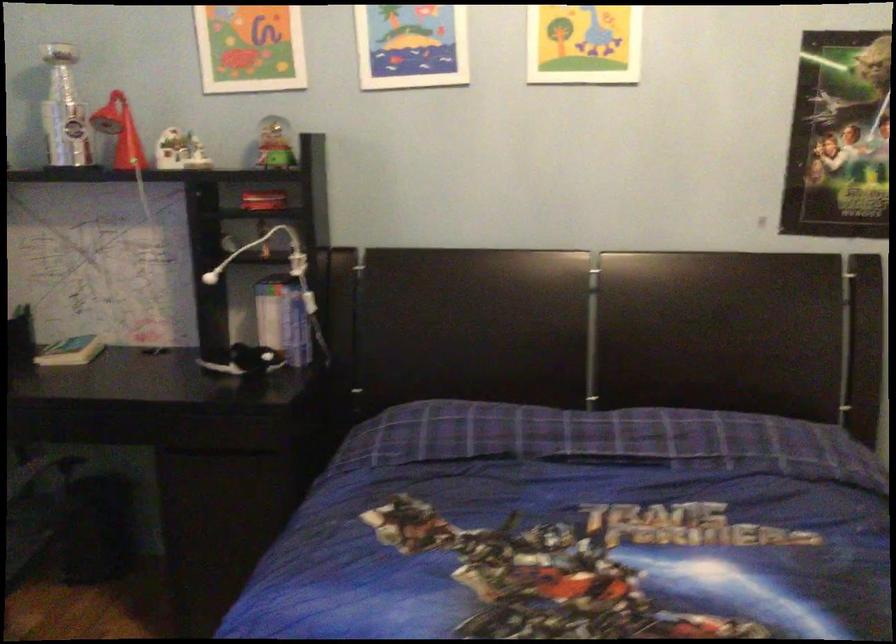
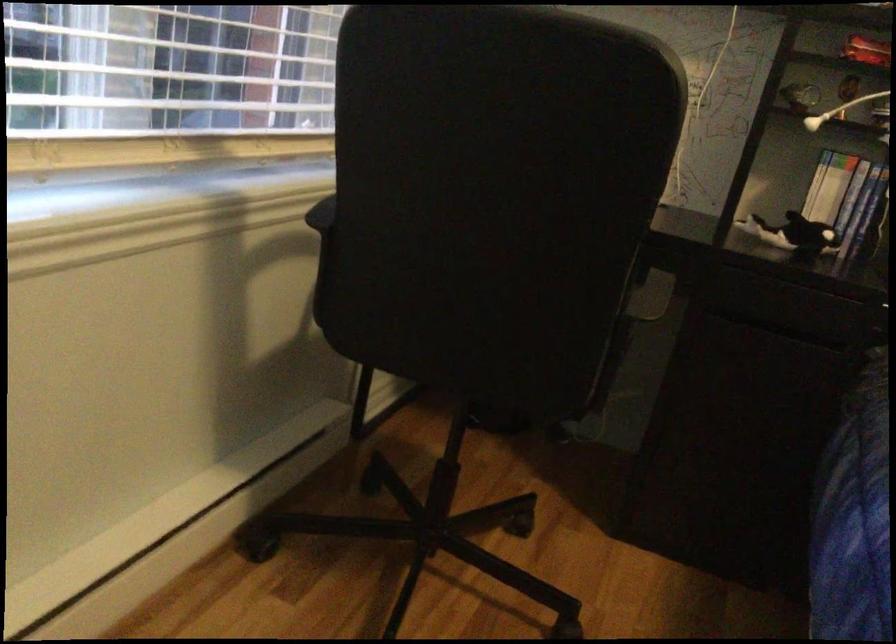
Question: I am providing you with two images of the same scene from different viewpoints. Please identify which objects are invisible in image2.

Choices:
 (A) orca whale toy
 (B) small blue book
 (C) stall door lock
 (D) black chair armrest

Answer: (B)